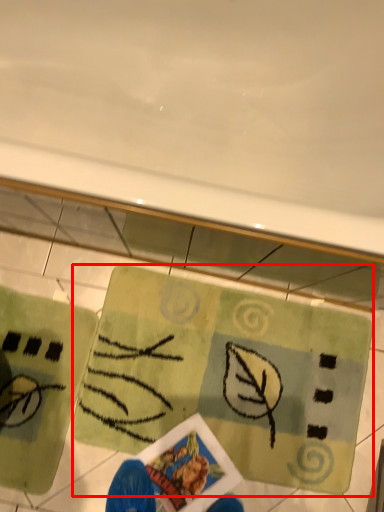
Question: From the image's perspective, where is yoga mat (annotated by the red box) located in relation to yoga mat in the image?

Choices:
 (A) below
 (B) above

Answer: (B)